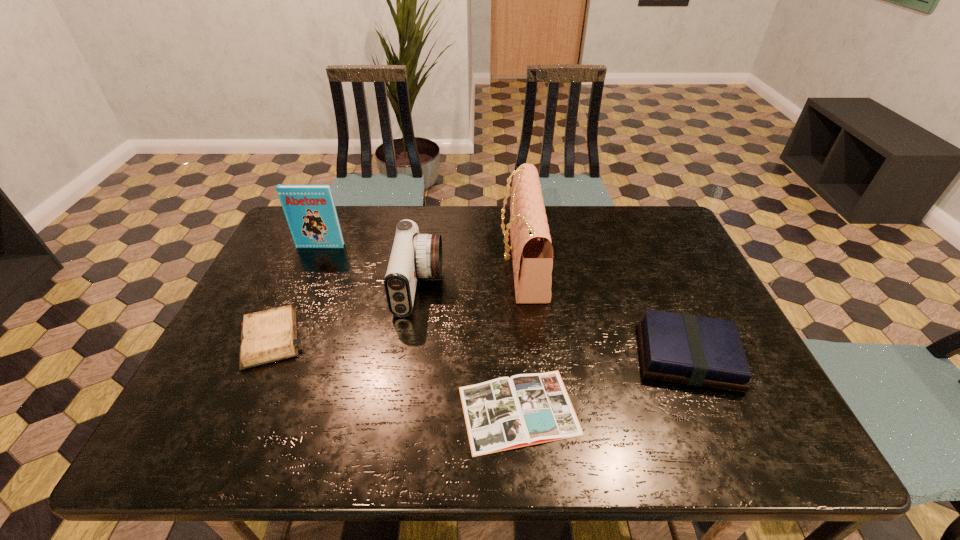
Image resolution: width=960 pixels, height=540 pixels. Find the location of `object that is at the near edge`. object that is at the near edge is located at coordinates (505, 413).

Find the location of a particular element. Image resolution: width=960 pixels, height=540 pixels. book that is at the left edge is located at coordinates (310, 211).

Image resolution: width=960 pixels, height=540 pixels. What are the coordinates of `diary at the left edge` in the screenshot? It's located at (268, 336).

The image size is (960, 540). In order to click on object situated at the right edge in this screenshot , I will do `click(699, 351)`.

The width and height of the screenshot is (960, 540). I want to click on object at the far left corner, so click(x=310, y=211).

Identify the location of vacant area at the far edge. point(554,207).

At what (x,y) coordinates should I click in order to perform the action: click on vacant space at the near edge. Please return your answer as a coordinate pair (x, y). This screenshot has height=540, width=960. Looking at the image, I should click on (617, 433).

Identify the location of vacant space at the left edge of the desktop. (252, 282).

The height and width of the screenshot is (540, 960). What are the coordinates of `free space at the near left corner` in the screenshot? It's located at (237, 439).

In the image, there is a desktop. At what (x,y) coordinates should I click in order to perform the action: click on free region at the near right corner. Please return your answer as a coordinate pair (x, y). The image size is (960, 540). Looking at the image, I should click on (764, 449).